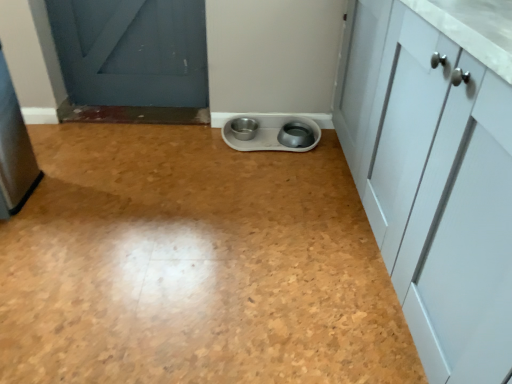
Where is `free spot in front of metallic gray bowls at center, acting as the 1th appliance starting from the right`? free spot in front of metallic gray bowls at center, acting as the 1th appliance starting from the right is located at coordinates (272, 173).